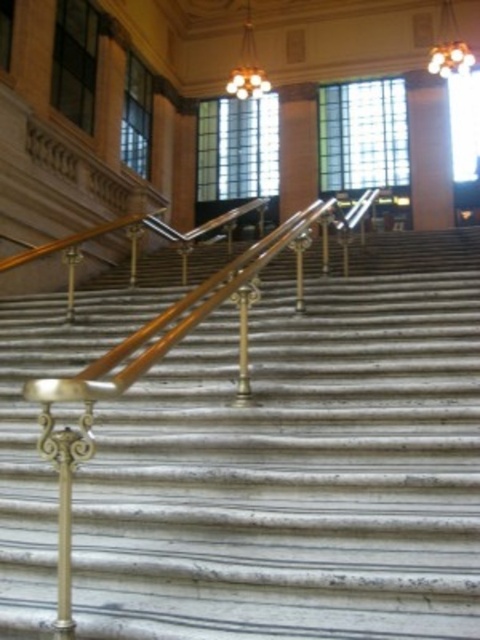
You are an interior designer planning to install a new lighting fixture in the historic building. You have two chandeliers available, the golden glass chandelier at upper center and the gold textured chandelier at upper center. According to the image, which chandelier is placed above the other?

The golden glass chandelier at upper center is positioned over the gold textured chandelier at upper center.

You are an interior designer assessing the space for a new artwork installation. You notice the white marble pillar at upper center and the gold textured chandelier at upper center. Which object would be more suitable for hanging a large decorative piece, considering their size?

The white marble pillar at upper center is bigger than the gold textured chandelier at upper center, making it more suitable for hanging a large decorative piece due to its larger size.